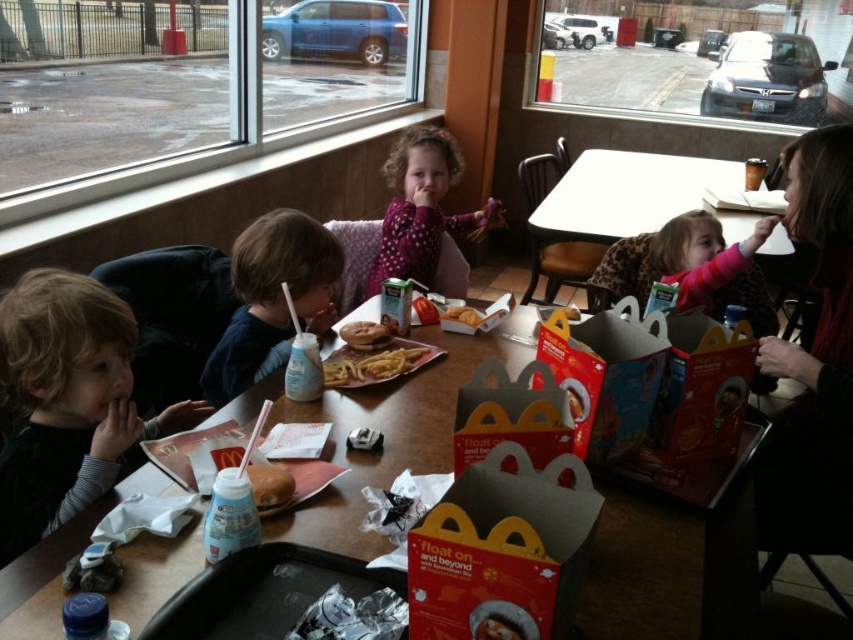
Question: Can you confirm if yellow crispy french fries at center is positioned to the right of golden crispy chicken at center?

Choices:
 (A) yes
 (B) no

Answer: (B)

Question: From the image, what is the correct spatial relationship of yellow crispy french fries at center in relation to brown matte donut at center?

Choices:
 (A) above
 (B) below

Answer: (A)

Question: Which object is closer to the camera taking this photo?

Choices:
 (A) brown matte donut at center
 (B) golden crispy chicken at center
 (C) dark blue shirt at left
 (D) golden crispy french fries at center

Answer: (A)

Question: Which is farther from the brown matte donut at center?

Choices:
 (A) black plastic tray at lower center
 (B) dark brown hair at left
 (C) golden crispy french fries at center

Answer: (C)

Question: Does pink dotted shirt at center appear on the left side of golden crispy french fries at center?

Choices:
 (A) yes
 (B) no

Answer: (B)

Question: Which point appears closest to the camera in this image?

Choices:
 (A) (289, 497)
 (B) (463, 314)
 (C) (326, 369)
 (D) (258, 246)

Answer: (A)